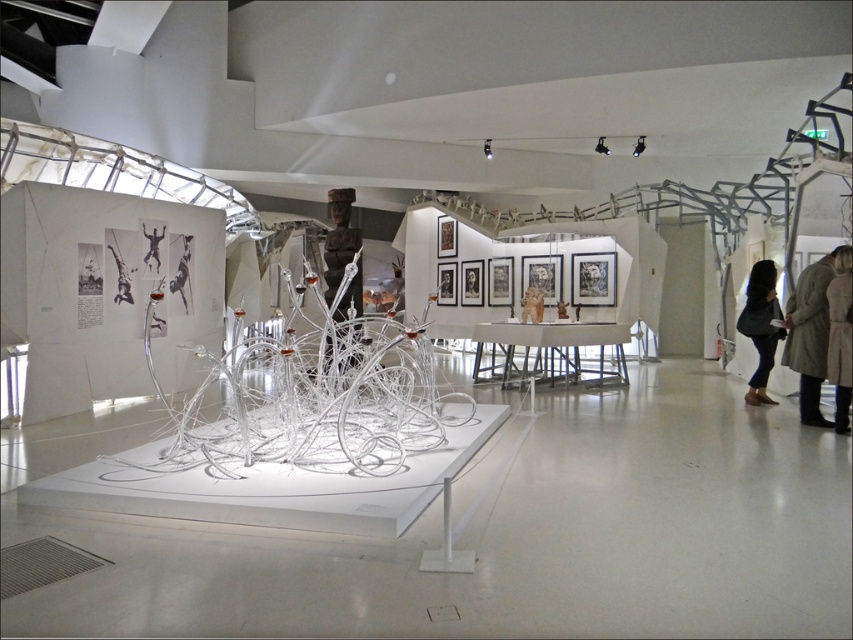
Question: Where is light beige coat at right located in relation to metallic figure at center in the image?

Choices:
 (A) below
 (B) above

Answer: (A)

Question: Which point is closer to the camera taking this photo?

Choices:
 (A) (146, 260)
 (B) (763, 396)
 (C) (833, 326)

Answer: (C)

Question: Which of the following is the farthest from the observer?

Choices:
 (A) metallic figure at center
 (B) black leather bag at right
 (C) light beige coat at right

Answer: (A)

Question: Does dark brown leather coat at lower right appear on the right side of metallic figure at center?

Choices:
 (A) no
 (B) yes

Answer: (B)

Question: Which point is closer to the camera?

Choices:
 (A) (753, 292)
 (B) (846, 296)
 (C) (788, 362)
 (D) (146, 253)

Answer: (B)

Question: From the image, what is the correct spatial relationship of light beige coat at right in relation to metallic figure at center?

Choices:
 (A) below
 (B) above

Answer: (A)